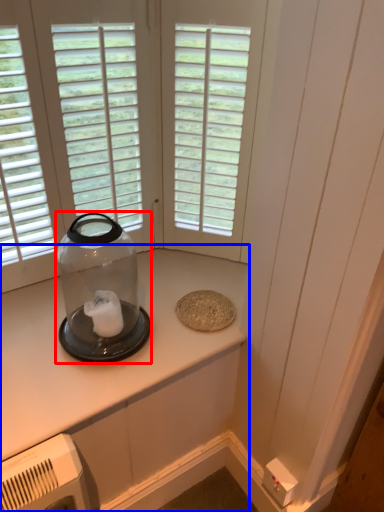
Question: Which point is further to the camera, glass bottle (highlighted by a red box) or countertop (highlighted by a blue box)?

Choices:
 (A) glass bottle
 (B) countertop

Answer: (B)